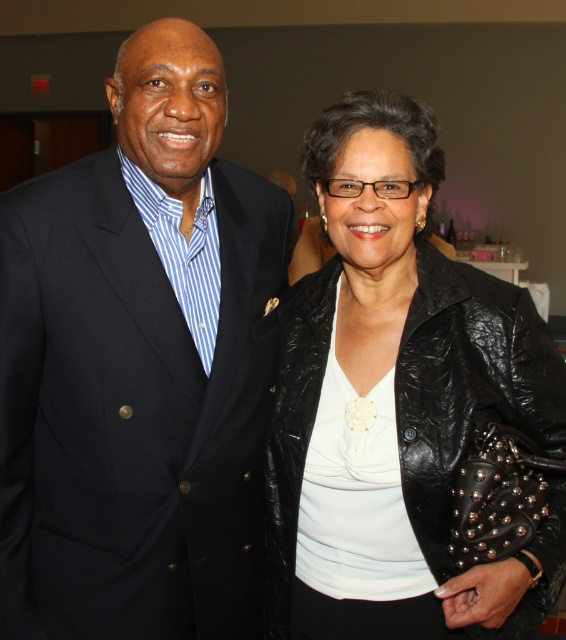
Does matte black suit at left have a smaller size compared to black leather jacket at right?

Incorrect, matte black suit at left is not smaller in size than black leather jacket at right.

Which is more to the right, matte black suit at left or black leather jacket at right?

From the viewer's perspective, black leather jacket at right appears more on the right side.

Is point (237, 474) positioned after point (285, 493)?

Yes, it is behind point (285, 493).

This screenshot has width=566, height=640. In order to click on matte black suit at left in this screenshot , I will do `click(139, 365)`.